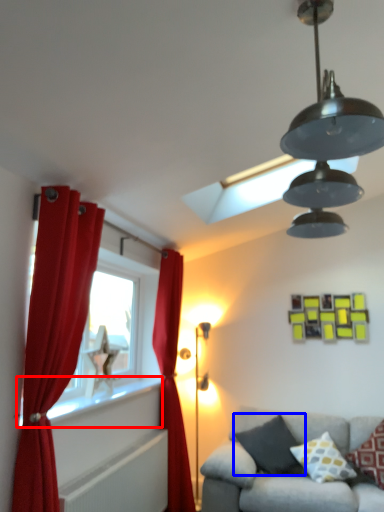
Question: Which point is closer to the camera, window sill (highlighted by a red box) or pillow (highlighted by a blue box)?

Choices:
 (A) window sill
 (B) pillow

Answer: (A)